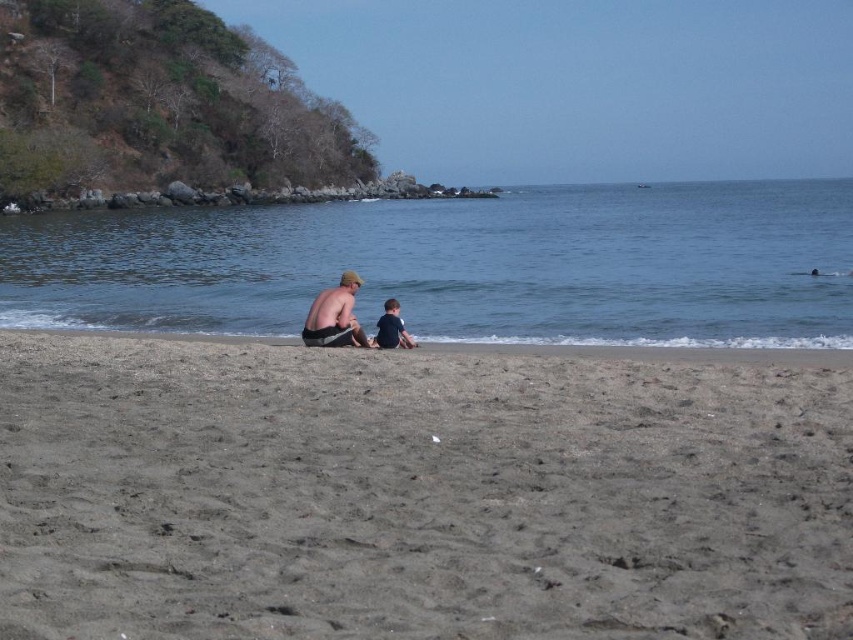
Question: Can you confirm if brown sandy beach at center is thinner than dark blue shirt at center?

Choices:
 (A) yes
 (B) no

Answer: (B)

Question: Among these objects, which one is farthest from the camera?

Choices:
 (A) matte black shorts at center
 (B) blue water at center
 (C) brown sandy beach at center
 (D) dark blue shirt at center

Answer: (B)

Question: Which object is positioned farthest from the dark blue shirt at center?

Choices:
 (A) blue water at center
 (B) brown sandy beach at center
 (C) matte black shorts at center

Answer: (A)

Question: In this image, where is blue water at center located relative to dark blue shirt at center?

Choices:
 (A) below
 (B) above

Answer: (B)

Question: Considering the real-world distances, which object is farthest from the dark blue shirt at center?

Choices:
 (A) matte black shorts at center
 (B) blue water at center
 (C) brown sandy beach at center

Answer: (B)

Question: Is brown sandy beach at center thinner than blue water at center?

Choices:
 (A) yes
 (B) no

Answer: (A)